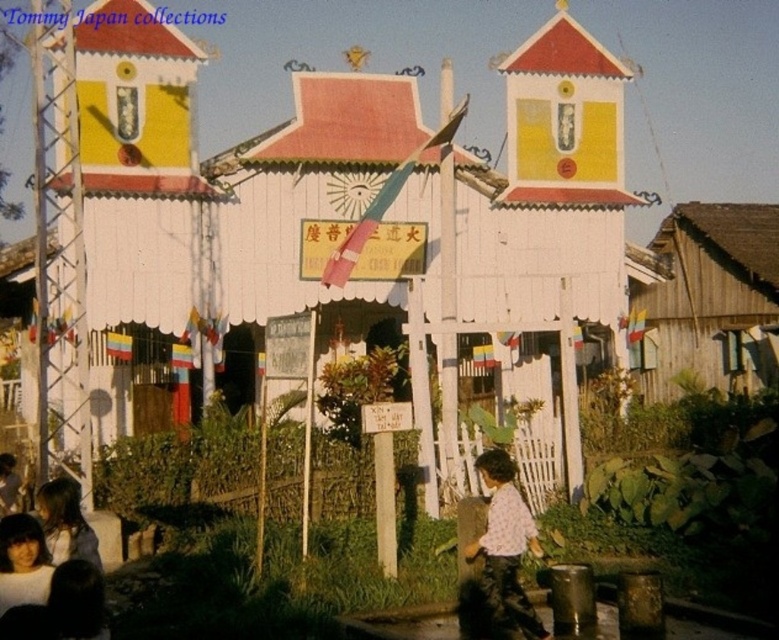
Between white textured shirt at center and light brown hair at lower left, which one has more height?

Standing taller between the two is white textured shirt at center.

Is white textured shirt at center bigger than light brown hair at lower left?

Correct, white textured shirt at center is larger in size than light brown hair at lower left.

Is point (471, 547) positioned before point (69, 513)?

No, (471, 547) is further to viewer.

Identify the location of white textured shirt at center. (506, 547).

Who is higher up, white wood hut at center or light brown hair at lower left?

white wood hut at center

Measure the distance between white wood hut at center and light brown hair at lower left.

They are 38.87 feet apart.

Identify the location of white wood hut at center. This screenshot has height=640, width=779. (538, 195).

What do you see at coordinates (711, 298) in the screenshot? This screenshot has width=779, height=640. I see `wooden hut at right` at bounding box center [711, 298].

Is the position of wooden hut at right more distant than that of light brown hair at lower left?

Yes.

At what (x,y) coordinates should I click in order to perform the action: click on wooden hut at right. Please return your answer as a coordinate pair (x, y). The width and height of the screenshot is (779, 640). Looking at the image, I should click on (711, 298).